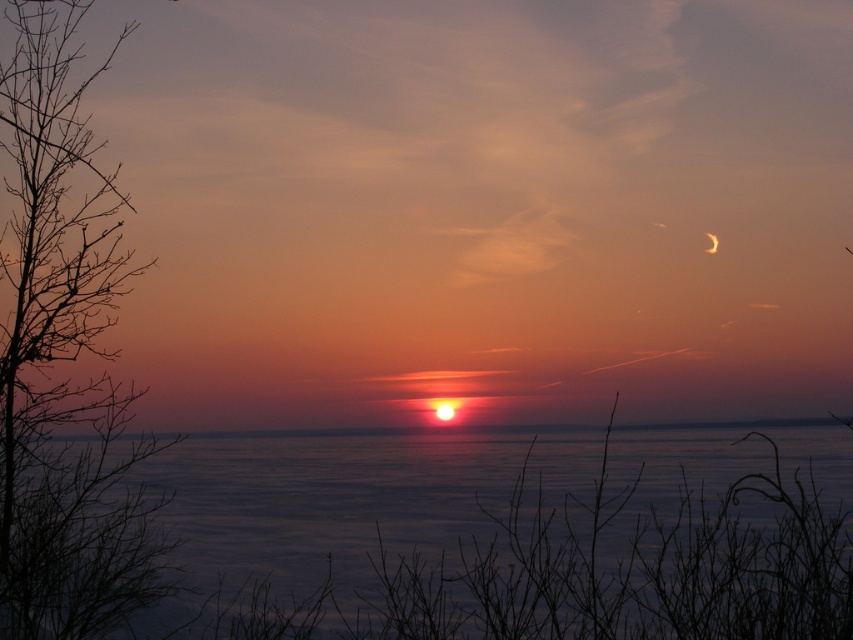
Can you confirm if blue water at center is shorter than silvery metallic crescent at upper right?

No.

Is point (495, 520) behind point (451, 408)?

No, it is not.

In order to click on blue water at center in this screenshot , I will do `click(489, 563)`.

Can you confirm if blue water at center is wider than silhouette branch at left?

Correct, the width of blue water at center exceeds that of silhouette branch at left.

Who is positioned more to the left, blue water at center or silhouette branch at left?

From the viewer's perspective, silhouette branch at left appears more on the left side.

Identify the location of blue water at center. This screenshot has height=640, width=853. (489, 563).

What do you see at coordinates (62, 356) in the screenshot? This screenshot has height=640, width=853. I see `silhouette branch at left` at bounding box center [62, 356].

Which is more to the left, silhouette branch at left or silvery metallic crescent at upper right?

silhouette branch at left is more to the left.

Describe the element at coordinates (62, 356) in the screenshot. I see `silhouette branch at left` at that location.

At what (x,y) coordinates should I click in order to perform the action: click on silhouette branch at left. Please return your answer as a coordinate pair (x, y). Image resolution: width=853 pixels, height=640 pixels. Looking at the image, I should click on (62, 356).